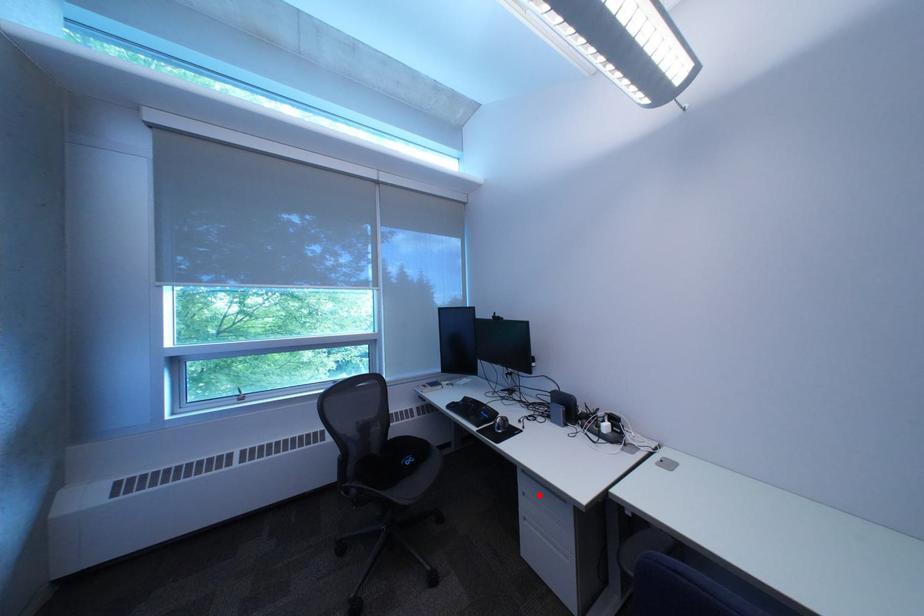
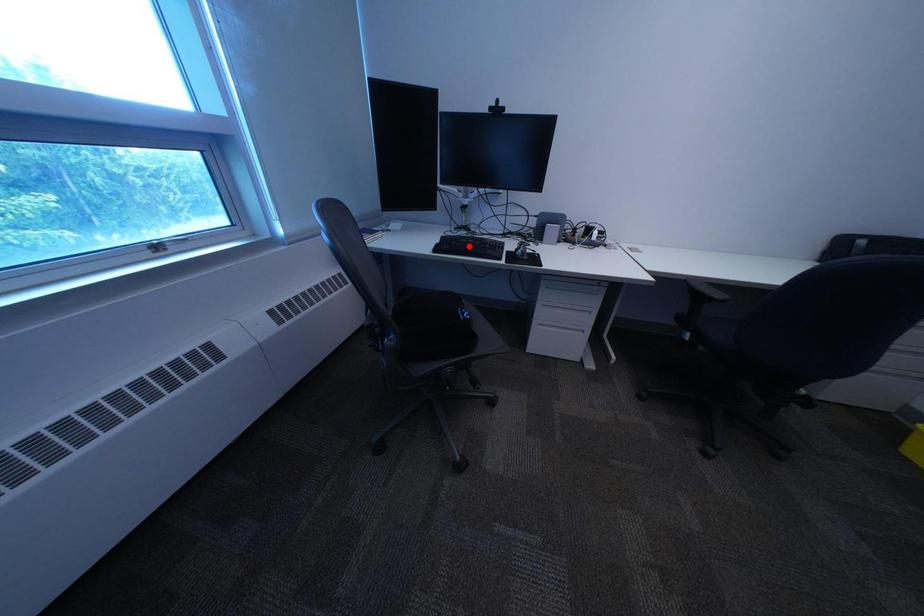
I am providing you with two images of the same scene from different viewpoints. A red point is marked on the first image and another point is marked on the second image. Does the point marked in image1 correspond to the same location as the one in image2?

No